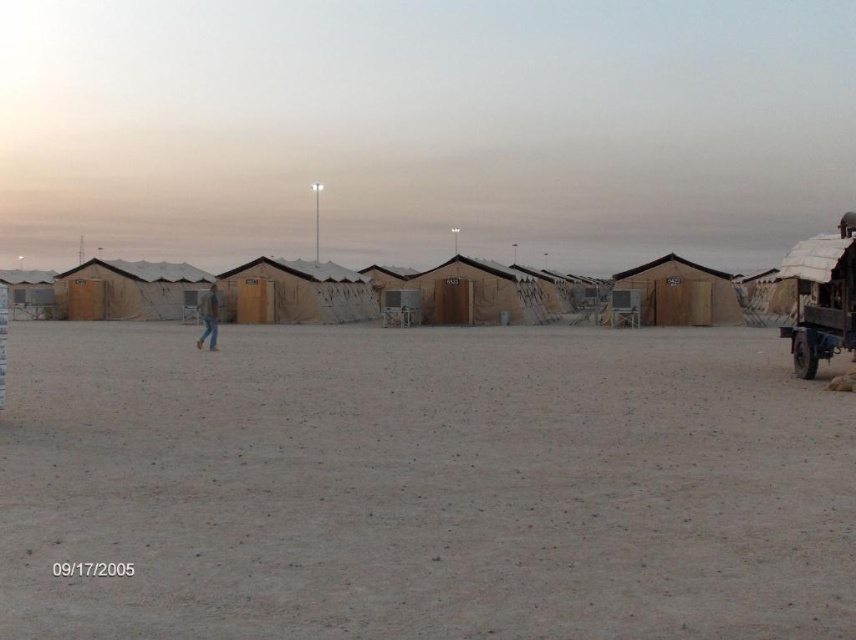
Can you confirm if brown wood cabin at center-right is wider than jeans at center?

Incorrect, brown wood cabin at center-right's width does not surpass jeans at center's.

Between brown wood cabin at center-right and jeans at center, which one appears on the right side from the viewer's perspective?

Positioned to the right is brown wood cabin at center-right.

Between point (694, 288) and point (215, 323), which one is positioned in front?

Point (215, 323) is in front.

Locate an element on the screen. The height and width of the screenshot is (640, 856). brown wood cabin at center-right is located at coordinates (681, 292).

Who is lower down, dull brown dirt at center or jeans at center?

dull brown dirt at center is below.

Describe the element at coordinates (423, 486) in the screenshot. I see `dull brown dirt at center` at that location.

Is point (700, 532) farther from camera compared to point (207, 342)?

No, (700, 532) is closer to viewer.

Find the location of a particular element. This screenshot has width=856, height=640. dull brown dirt at center is located at coordinates (423, 486).

Consider the image. Does dull brown dirt at center come in front of brown wood cabin at center-right?

That is True.

Which of these two, dull brown dirt at center or brown wood cabin at center-right, stands shorter?

dull brown dirt at center is shorter.

The width and height of the screenshot is (856, 640). Find the location of `dull brown dirt at center`. dull brown dirt at center is located at coordinates (423, 486).

Identify the location of dull brown dirt at center. tap(423, 486).